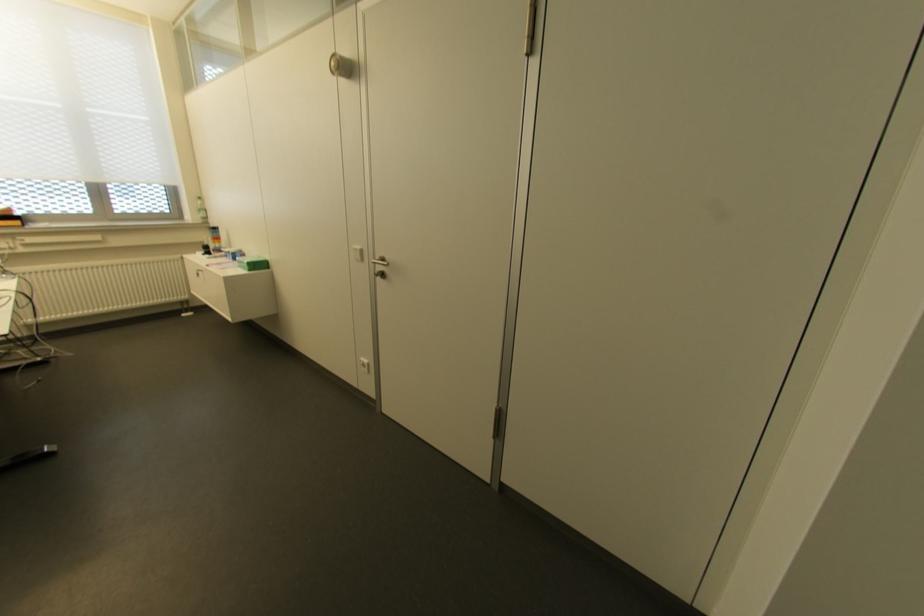
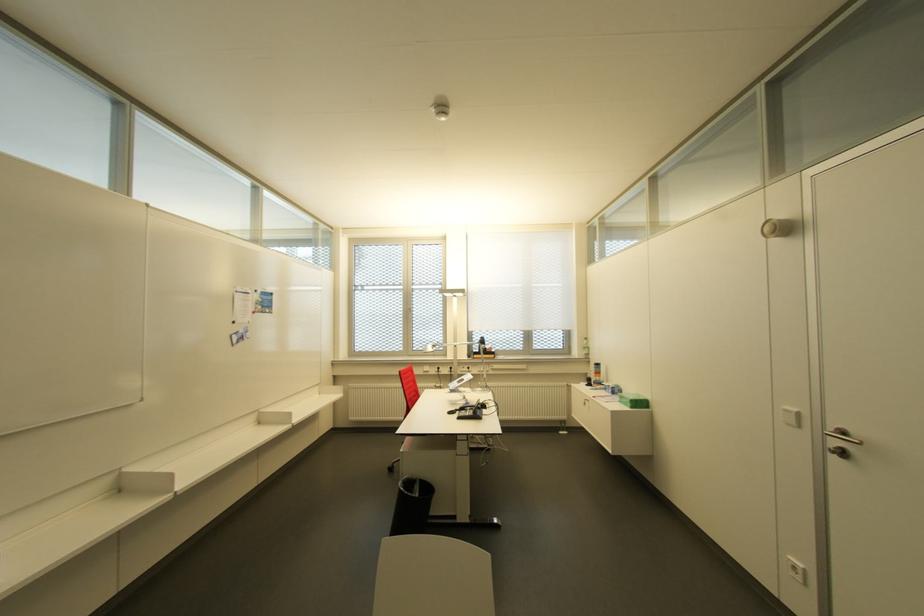
Question: The camera is either moving clockwise (left) or counter-clockwise (right) around the object. The first image is from the beginning of the video and the second image is from the end. Is the camera moving left or right when shooting the video?

Choices:
 (A) Left
 (B) Right

Answer: (B)